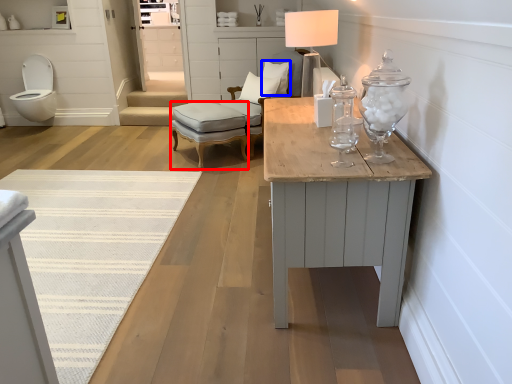
Question: Among these objects, which one is nearest to the camera, stool (highlighted by a red box) or pillow (highlighted by a blue box)?

Choices:
 (A) stool
 (B) pillow

Answer: (A)